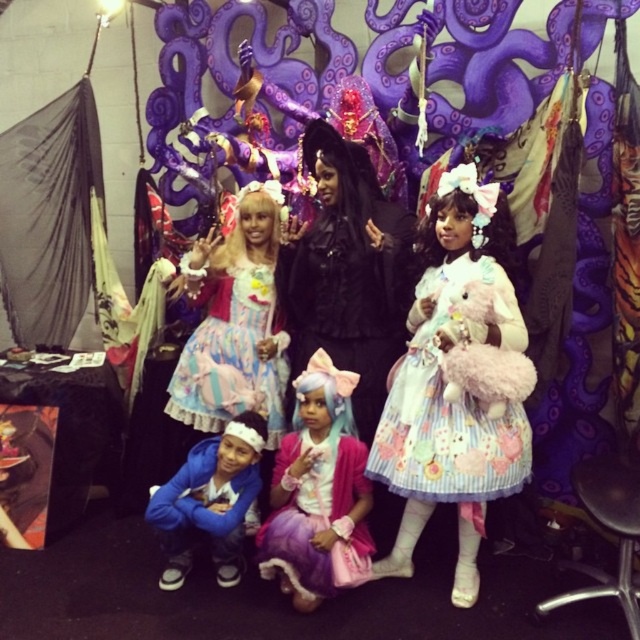
Is point (392, 234) more distant than point (307, 516)?

Yes, point (392, 234) is behind point (307, 516).

Image resolution: width=640 pixels, height=640 pixels. In order to click on matte black dress at center in this screenshot , I will do `click(349, 272)`.

Is point (500, 428) less distant than point (266, 554)?

Yes, it is in front of point (266, 554).

Measure the distance between pastel striped dress at center and pastel pink fabric dress at center.

pastel striped dress at center is 13.89 inches away from pastel pink fabric dress at center.

Measure the distance between point [451,401] and camera.

A distance of 7.06 feet exists between point [451,401] and camera.

Image resolution: width=640 pixels, height=640 pixels. I want to click on pastel striped dress at center, so click(456, 385).

Can you confirm if matte black dress at center is smaller than blue fleece jacket at lower left?

Actually, matte black dress at center might be larger than blue fleece jacket at lower left.

Does matte black dress at center appear on the left side of blue fleece jacket at lower left?

No, matte black dress at center is not to the left of blue fleece jacket at lower left.

Identify the location of matte black dress at center. The image size is (640, 640). (349, 272).